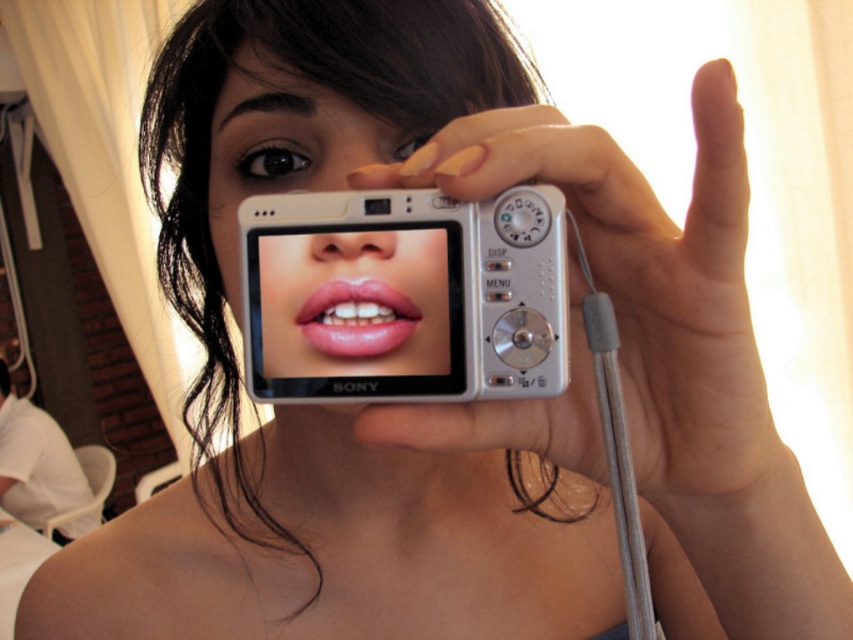
This screenshot has height=640, width=853. Find the location of `white plastic camera at center`. white plastic camera at center is located at coordinates (403, 296).

Does white plastic camera at center come behind matte white camera at center?

That is True.

Is point (531, 307) closer to viewer compared to point (231, 225)?

Yes.

At what (x,y) coordinates should I click in order to perform the action: click on white plastic camera at center. Please return your answer as a coordinate pair (x, y). The image size is (853, 640). Looking at the image, I should click on (403, 296).

Based on the photo, is matte white camera at center taller than white fabric at lower left?

In fact, matte white camera at center may be shorter than white fabric at lower left.

Who is more distant from viewer, (x=289, y=161) or (x=55, y=442)?

Point (x=55, y=442)

The image size is (853, 640). Find the location of `matte white camera at center`. matte white camera at center is located at coordinates (289, 147).

You are a GUI agent. You are given a task and a screenshot of the screen. Output one action in this format:
    pyautogui.click(x=<x>, y=<y>)
    Task: Click on the matte white camera at center
    
    Given the screenshot: What is the action you would take?
    pyautogui.click(x=289, y=147)

Does white fabric at lower left have a greater height compared to pink glossy lips at center?

Correct, white fabric at lower left is much taller as pink glossy lips at center.

Can you confirm if white fabric at lower left is positioned to the right of pink glossy lips at center?

Incorrect, white fabric at lower left is not on the right side of pink glossy lips at center.

Is point (35, 406) positioned after point (370, 305)?

That is True.

You are a GUI agent. You are given a task and a screenshot of the screen. Output one action in this format:
    pyautogui.click(x=<x>, y=<y>)
    Task: Click on the white fabric at lower left
    Image resolution: width=853 pixels, height=640 pixels.
    Given the screenshot: What is the action you would take?
    pyautogui.click(x=35, y=461)